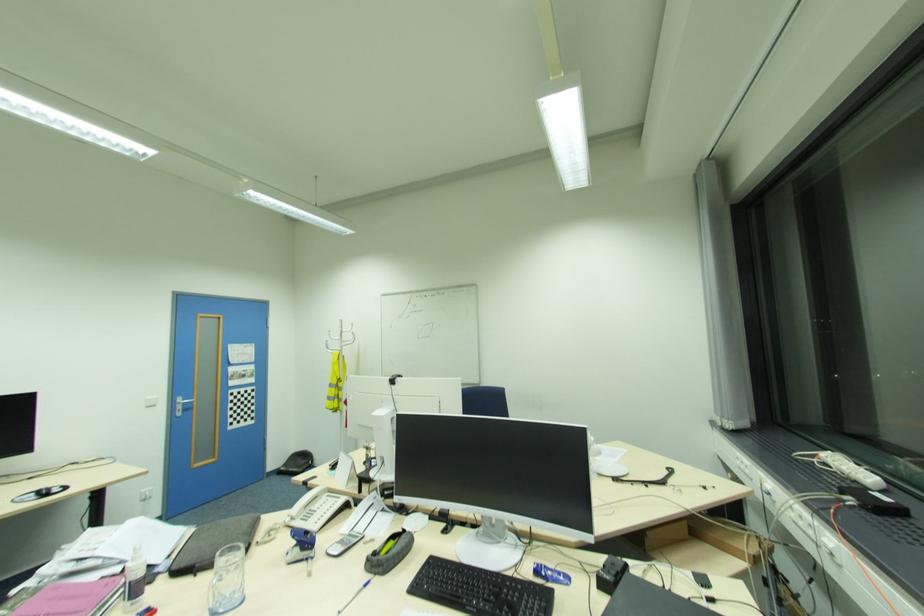
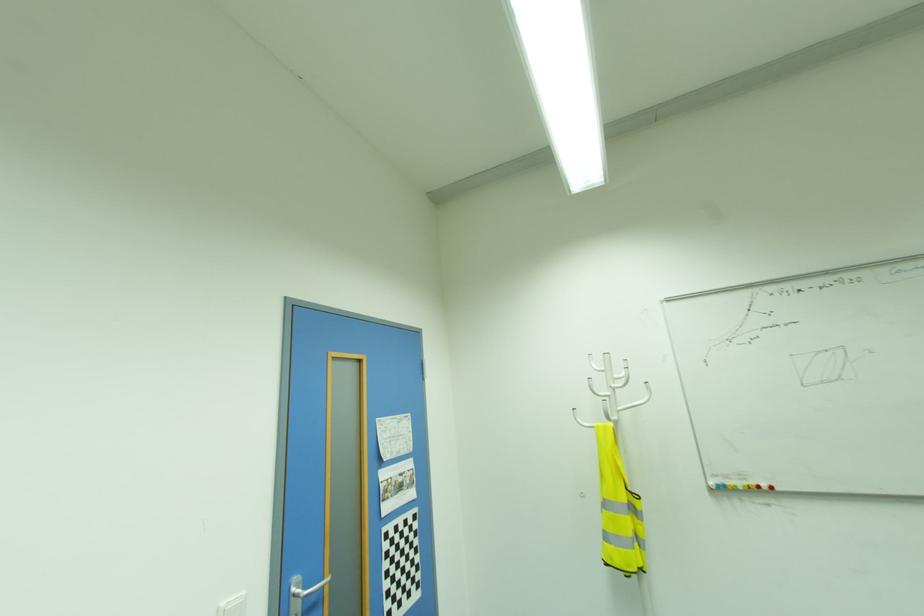
In the second image, find the point that corresponds to [345,345] in the first image.

(622, 408)